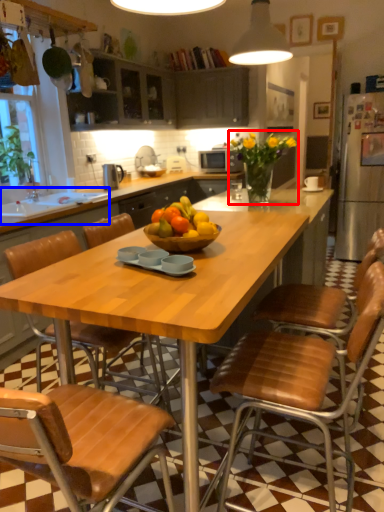
Question: Which of the following is the farthest to the observer, flower (highlighted by a red box) or sink (highlighted by a blue box)?

Choices:
 (A) flower
 (B) sink

Answer: (B)